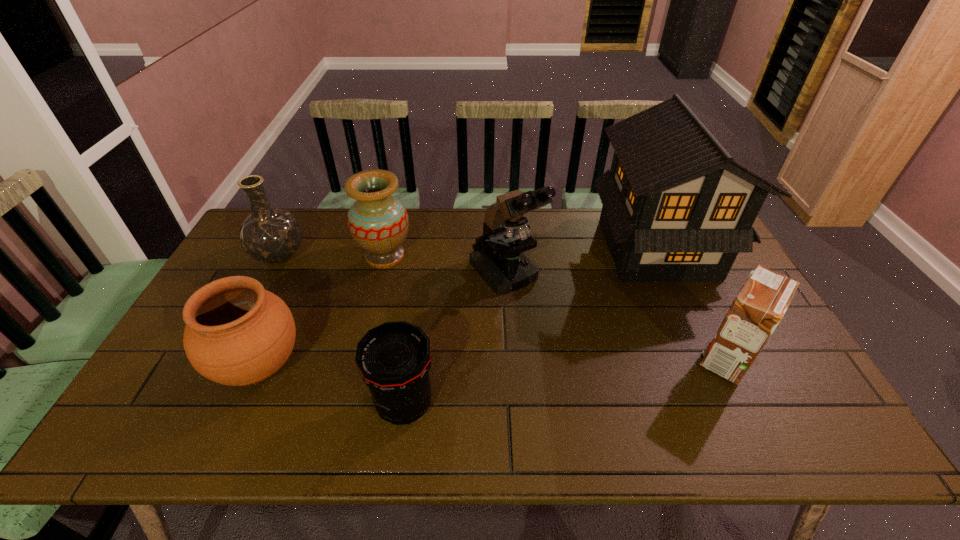
The height and width of the screenshot is (540, 960). In the image, there is a desktop. In order to click on vacant space at the near right corner in this screenshot , I will do `click(763, 428)`.

The image size is (960, 540). I want to click on free space between the carton and the right vase, so [x=556, y=307].

Where is `free space between the telephoto lens and the pottery`? free space between the telephoto lens and the pottery is located at coordinates (332, 386).

At what (x,y) coordinates should I click in order to perform the action: click on free spot between the carton and the telephoto lens. Please return your answer as a coordinate pair (x, y). This screenshot has height=540, width=960. Looking at the image, I should click on (565, 382).

The width and height of the screenshot is (960, 540). Identify the location of free spot between the pottery and the right vase. (323, 311).

Identify the location of free space between the carton and the tallest object. (692, 303).

Locate an element on the screen. vacant area between the carton and the pottery is located at coordinates (493, 362).

Locate which object is the fourth closest to the right vase. Please provide its 2D coordinates. Your answer should be formatted as a tuple, i.e. [(x, y)], where the tuple contains the x and y coordinates of a point satisfying the conditions above.

[(394, 359)]

Locate an element on the screen. This screenshot has width=960, height=540. object that can be found as the fifth closest to the right vase is located at coordinates (682, 194).

The width and height of the screenshot is (960, 540). What are the coordinates of `vacant space that satisfies the following two spatial constraints: 1. on the front-facing side of the dollhouse; 2. on the front side of the pottery` in the screenshot? It's located at (712, 366).